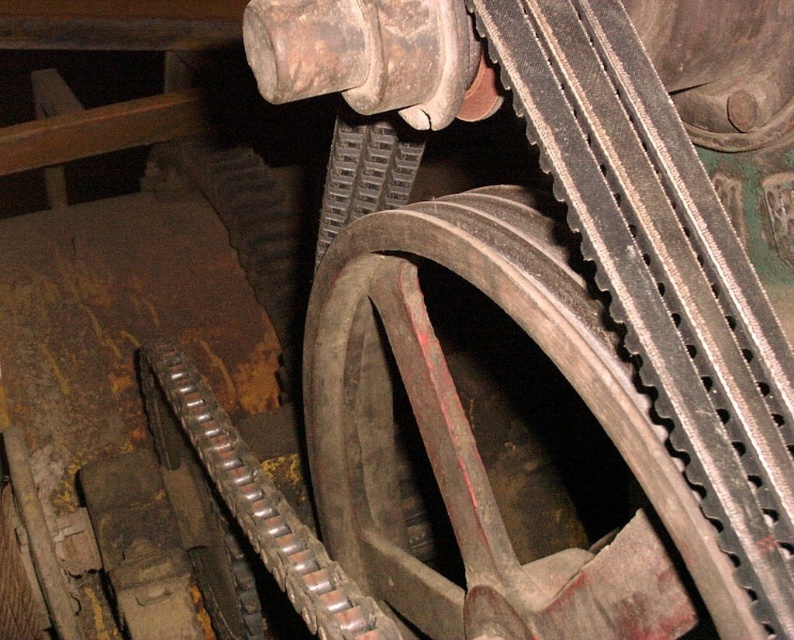
Who is taller, rusty metal gear at center or rusty metal wheel at center?

Standing taller between the two is rusty metal gear at center.

Who is more distant from viewer, (392, 305) or (315, 252)?

The point (315, 252) is more distant.

What do you see at coordinates (476, 444) in the screenshot?
I see `rusty metal gear at center` at bounding box center [476, 444].

I want to click on rusty metal gear at center, so click(476, 444).